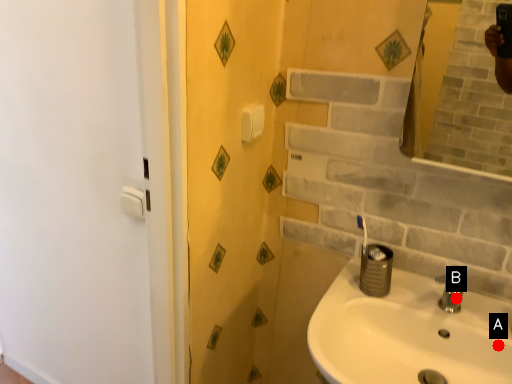
Question: Two points are circled on the image, labeled by A and B beside each circle. Which point appears farthest from the camera in this image?

Choices:
 (A) A is further
 (B) B is further

Answer: (B)